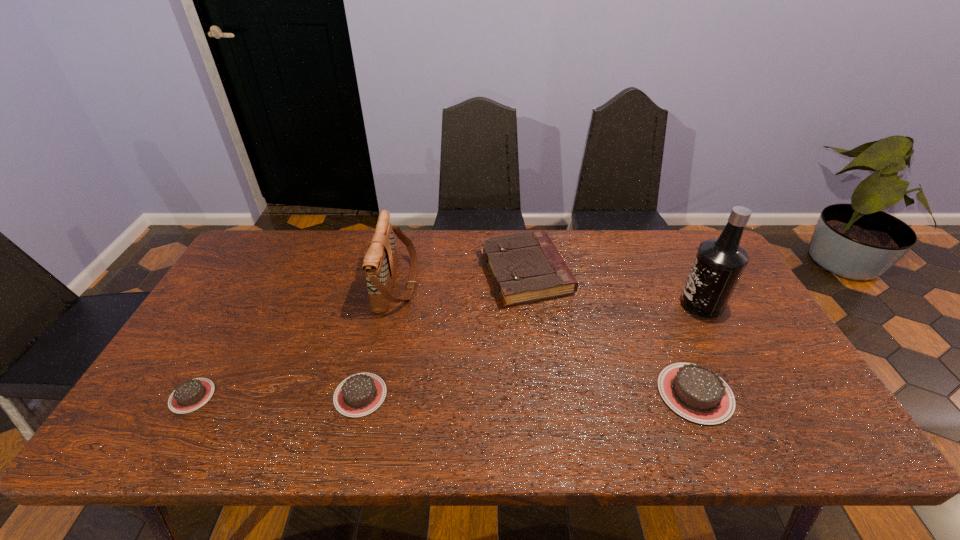
At what (x,y) coordinates should I click in order to perform the action: click on free spot between the second shortest object and the tallest object. Please return your answer as a coordinate pair (x, y). Looking at the image, I should click on (531, 349).

Where is `empty location between the fifth shortest object and the rightmost chocolate cake`? empty location between the fifth shortest object and the rightmost chocolate cake is located at coordinates (546, 339).

At what (x,y) coordinates should I click in order to perform the action: click on vacant area that lies between the third tallest object and the tallest object. Please return your answer as a coordinate pair (x, y). Looking at the image, I should click on (613, 288).

This screenshot has height=540, width=960. I want to click on free space between the tallest chocolate cake and the second shortest object, so click(528, 394).

You are a GUI agent. You are given a task and a screenshot of the screen. Output one action in this format:
    pyautogui.click(x=<x>, y=<y>)
    Task: Click on the free spot between the liquor and the tallest chocolate cake
    The image size is (960, 540).
    Given the screenshot: What is the action you would take?
    pyautogui.click(x=698, y=348)

The width and height of the screenshot is (960, 540). I want to click on the fourth closest object to the fifth shortest object, so click(x=696, y=393).

Select which object is the closest to the liquor. Please provide its 2D coordinates. Your answer should be formatted as a tuple, i.e. [(x, y)], where the tuple contains the x and y coordinates of a point satisfying the conditions above.

[(696, 393)]

Identify which chocolate cake is the nearest to the second chocolate cake from left to right. Please provide its 2D coordinates. Your answer should be formatted as a tuple, i.e. [(x, y)], where the tuple contains the x and y coordinates of a point satisfying the conditions above.

[(192, 394)]

At what (x,y) coordinates should I click in order to perform the action: click on the closest chocolate cake to the tallest chocolate cake. Please return your answer as a coordinate pair (x, y). This screenshot has width=960, height=540. Looking at the image, I should click on (360, 394).

The image size is (960, 540). I want to click on free region that satisfies the following two spatial constraints: 1. on the front label of the tallest object; 2. on the front side of the second chocolate cake from left to right, so click(751, 395).